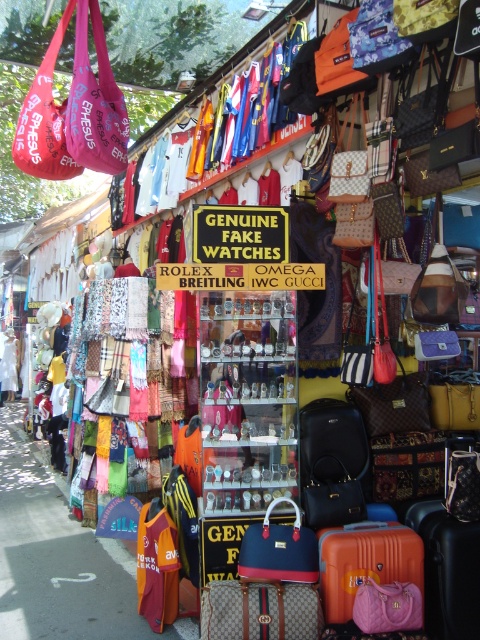
Can you confirm if white concrete pavement at lower left is positioned to the left of orange leather suitcase at lower right?

Yes, white concrete pavement at lower left is to the left of orange leather suitcase at lower right.

Does point (141, 636) come in front of point (414, 512)?

Yes, point (141, 636) is closer to viewer.

Find the location of a particular element. The image size is (480, 640). white concrete pavement at lower left is located at coordinates click(x=60, y=557).

Measure the distance between pink fabric bag at upper left and camera.

A distance of 12.18 feet exists between pink fabric bag at upper left and camera.

Does point (80, 140) come closer to viewer compared to point (275, 632)?

No, (80, 140) is behind (275, 632).

Image resolution: width=480 pixels, height=640 pixels. What are the coordinates of `pink fabric bag at upper left` in the screenshot? It's located at (95, 102).

Looking at this image, is white concrete pavement at lower left behind guccy fabric suitcase at center?

Yes, white concrete pavement at lower left is behind guccy fabric suitcase at center.

This screenshot has width=480, height=640. What are the coordinates of `white concrete pavement at lower left` in the screenshot? It's located at (60, 557).

The image size is (480, 640). What are the coordinates of `white concrete pavement at lower left` in the screenshot? It's located at click(x=60, y=557).